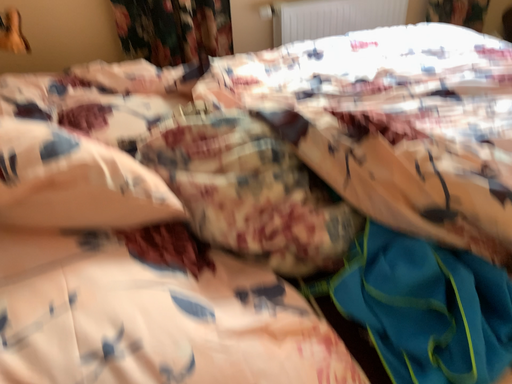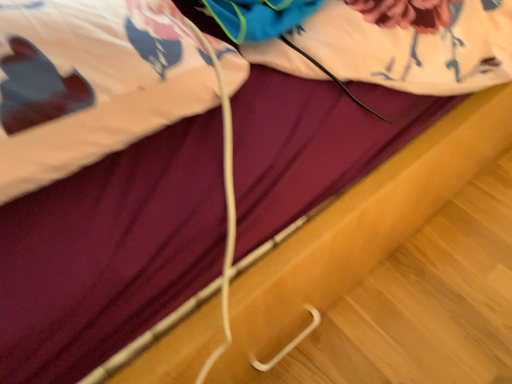
Question: Which way did the camera rotate in the video?

Choices:
 (A) rotated left
 (B) rotated right

Answer: (B)